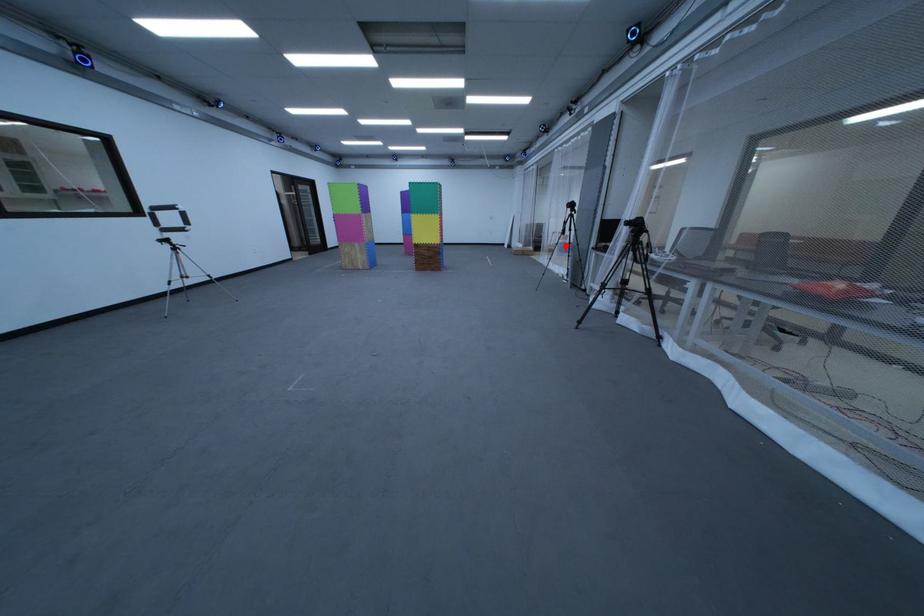
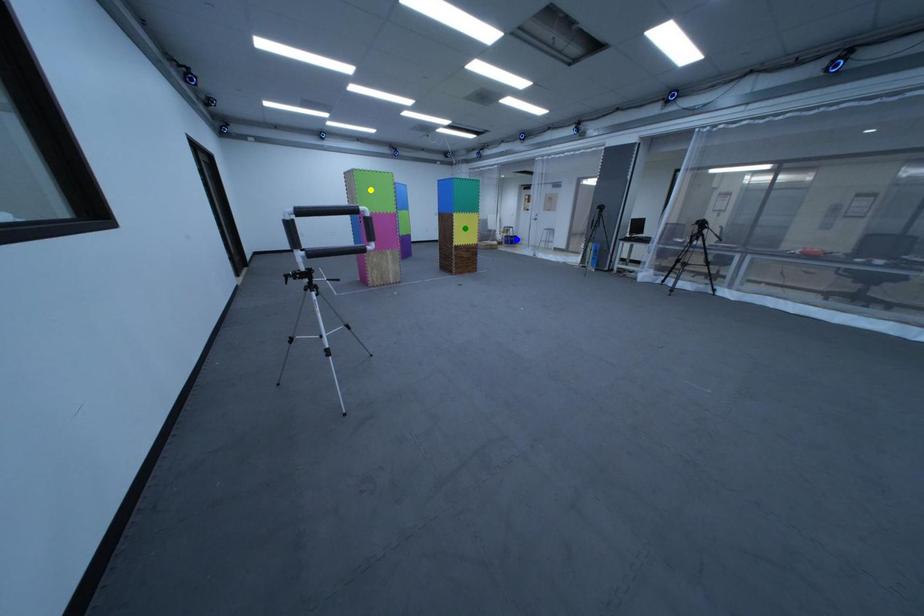
Question: I am providing you with two images of the same scene from different viewpoints. A red point is marked on the first image. You are given multiple points on the second image. Which mark in image 2 goes with the point in image 1?

Choices:
 (A) yellow point
 (B) green point
 (C) blue point

Answer: (C)